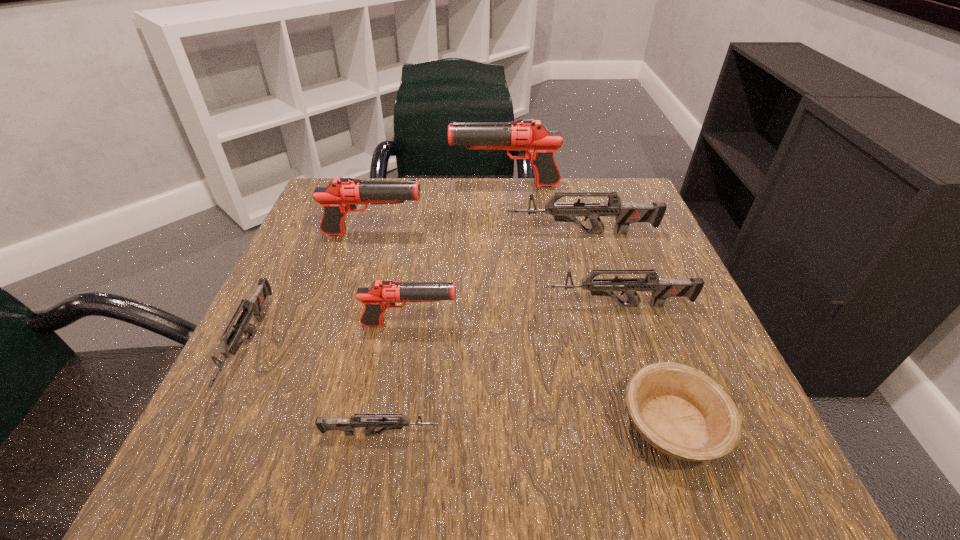
Locate an element on the screen. Image resolution: width=960 pixels, height=540 pixels. object that is at the far left corner is located at coordinates (341, 195).

Identify the location of object that is at the far right corner. The height and width of the screenshot is (540, 960). (626, 213).

Find the location of `object that is positioned at the near right corner`. object that is positioned at the near right corner is located at coordinates (682, 412).

Identify the location of vacant space at the far edge of the desktop. (479, 195).

In the image, there is a desktop. Identify the location of free space at the left edge. (335, 268).

In the image, there is a desktop. Find the location of `vacant area at the right edge`. vacant area at the right edge is located at coordinates (651, 268).

Identify the location of vacant point at the far left corner. The width and height of the screenshot is (960, 540). (369, 180).

In the image, there is a desktop. Identify the location of vacant area at the near left corner. (252, 434).

Find the location of `free space at the far right corner`. free space at the far right corner is located at coordinates (636, 190).

What are the coordinates of `free space between the tallest object and the smallest black gun` in the screenshot? It's located at (457, 255).